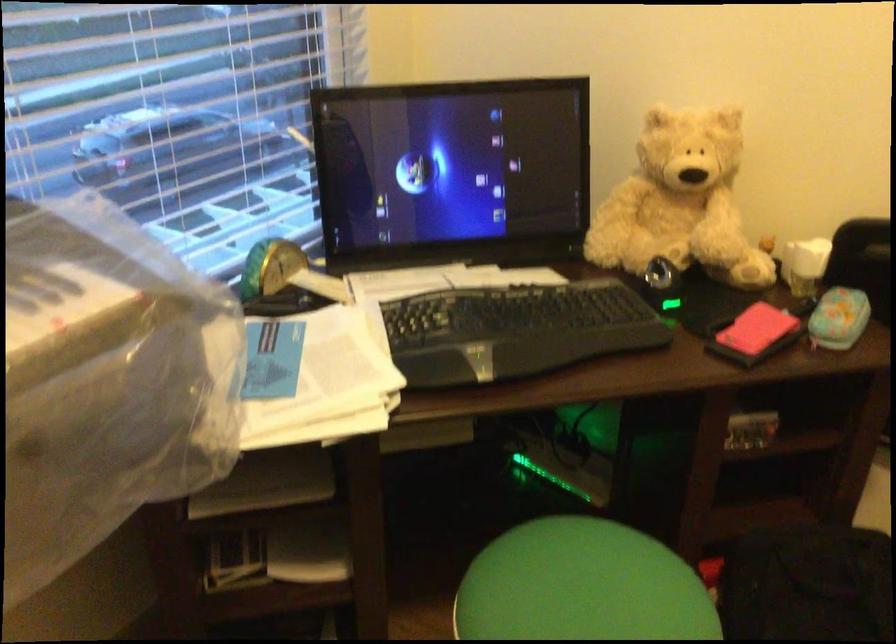
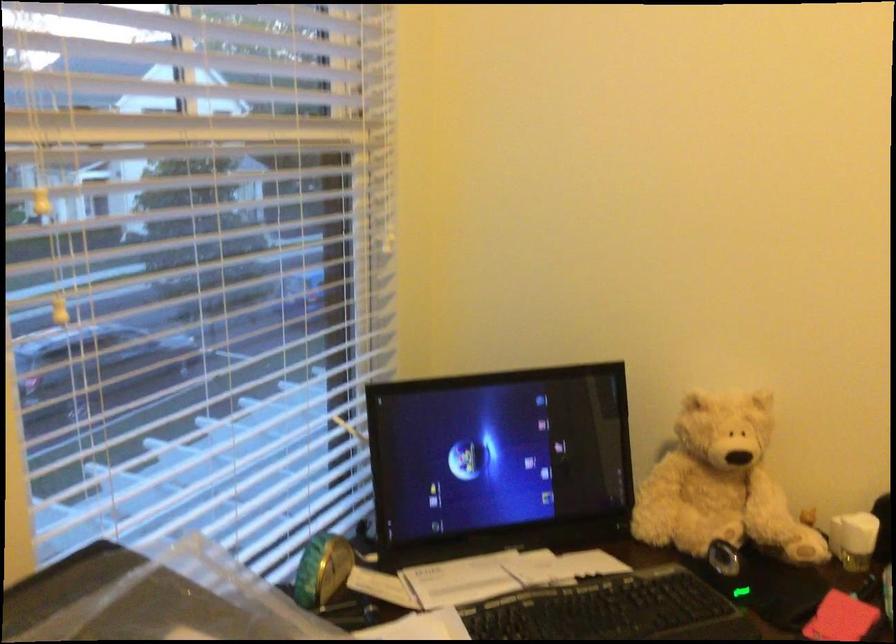
In the second image, find the point that corresponds to [271,257] in the first image.

(322, 569)